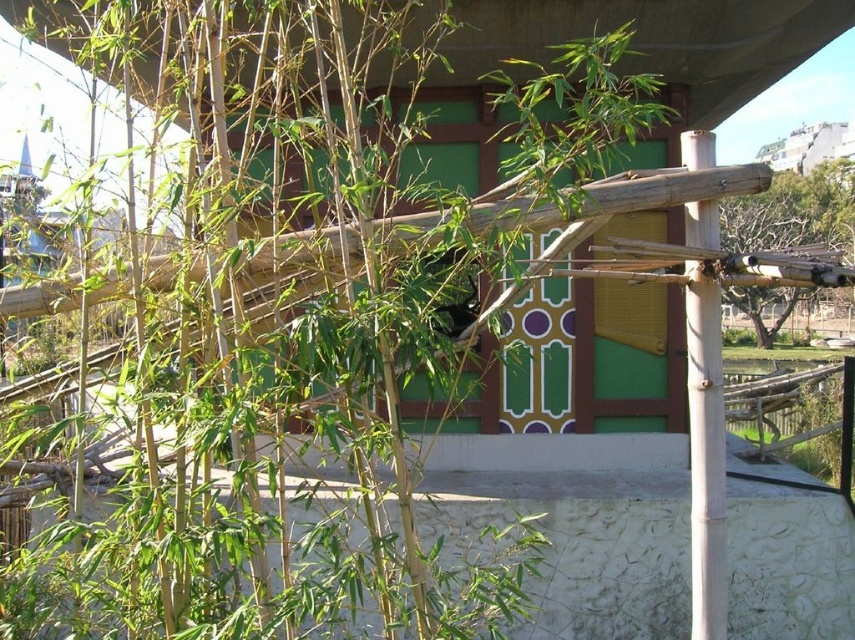
Question: Can you confirm if smooth bamboo pole at right is positioned below bare wood structure at right?

Choices:
 (A) no
 (B) yes

Answer: (B)

Question: Does smooth bamboo pole at right have a lesser width compared to bare wood structure at right?

Choices:
 (A) no
 (B) yes

Answer: (B)

Question: Which object is closer to the camera taking this photo?

Choices:
 (A) bare wood structure at right
 (B) smooth bamboo pole at right

Answer: (A)

Question: Does smooth bamboo pole at right come in front of bare wood structure at right?

Choices:
 (A) yes
 (B) no

Answer: (B)

Question: Among these objects, which one is farthest from the camera?

Choices:
 (A) bare wood structure at right
 (B) smooth bamboo pole at right

Answer: (B)